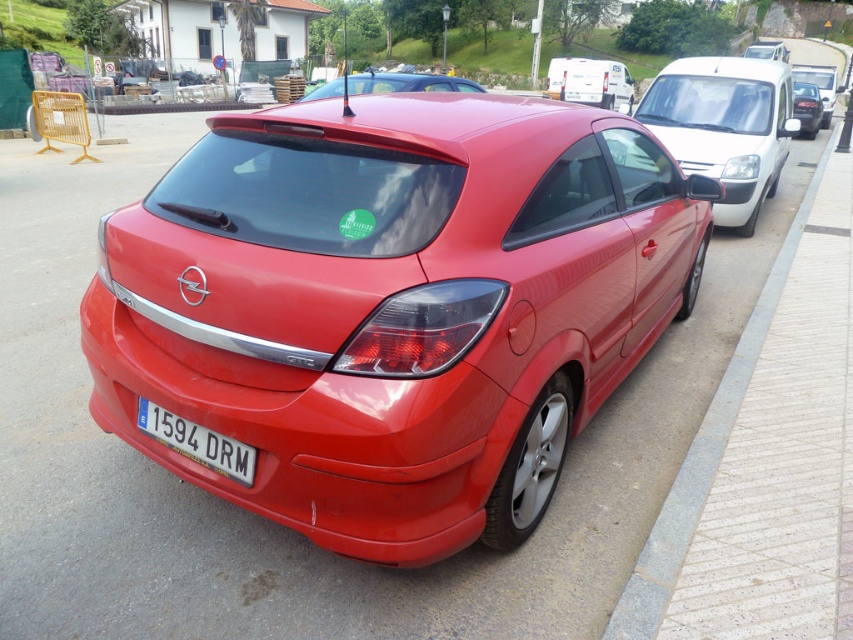
Question: Can you confirm if white plastic license plate at center is smaller than glossy red car at center?

Choices:
 (A) no
 (B) yes

Answer: (B)

Question: Can you confirm if gray concrete curb at lower right is wider than glossy red car at center?

Choices:
 (A) no
 (B) yes

Answer: (A)

Question: Estimate the real-world distances between objects in this image. Which object is closer to the glossy metallic van at upper right?

Choices:
 (A) glossy red car at center
 (B) white plastic license plate at center
 (C) gray concrete curb at lower right

Answer: (A)

Question: Can you confirm if white plastic license plate at center is positioned below glossy red car at center?

Choices:
 (A) yes
 (B) no

Answer: (A)

Question: Which point is closer to the camera?

Choices:
 (A) white plastic license plate at center
 (B) glossy red car at center

Answer: (A)

Question: Which point is farther to the camera?

Choices:
 (A) white plastic license plate at center
 (B) white glossy van at upper right

Answer: (B)